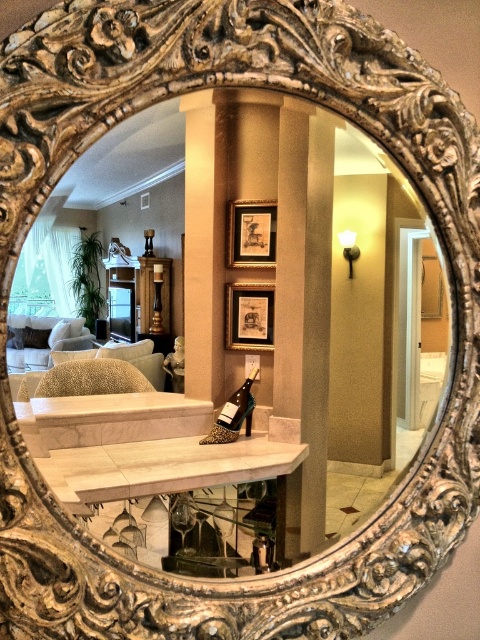
In the scene shown: You are standing in front of the decorative mirror and notice two points marked in the reflection. The first point is at coordinates point (x=204, y=259) and the second is at point (x=237, y=291). Which of these points is closer to you?

Point (x=204, y=259) is in front of point (x=237, y=291), so it is closer to you.

In the scene shown: You are standing in the living area and want to place a new painting on the wall so that it aligns with the gold ornate mirror at center. Where should you position the painting relative to the mirror?

The gold ornate mirror at center is located at point (252, 356), so you should position the painting at the same coordinates to ensure alignment.